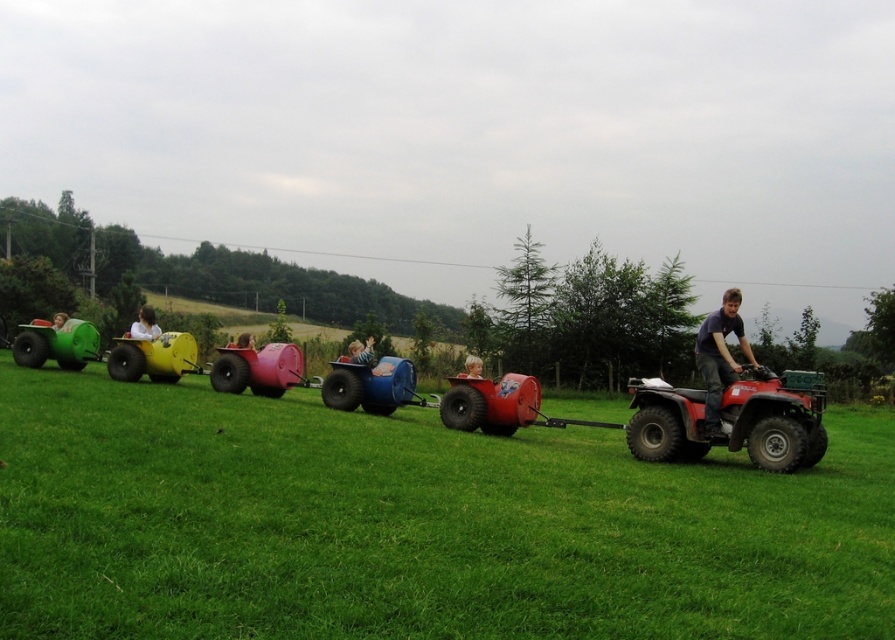
Question: Based on their relative distances, which object is farther from the rubberized plastic cart at center?

Choices:
 (A) blue rubber toy at center
 (B) smooth pink helmet at center
 (C) dark blue shirt at right

Answer: (B)

Question: Can you confirm if smooth pink helmet at center is smaller than matte green cart at left?

Choices:
 (A) no
 (B) yes

Answer: (B)

Question: Which point is closer to the camera?

Choices:
 (A) blue rubber toy at center
 (B) smooth pink helmet at center
 (C) blonde hair at center
 (D) rubberized plastic cart at center

Answer: (D)

Question: In this image, where is rubberized plastic cart at center located relative to matte green cart at left?

Choices:
 (A) above
 (B) below

Answer: (B)

Question: Which point appears farthest from the camera in this image?

Choices:
 (A) (744, 346)
 (B) (158, 332)
 (C) (62, 316)

Answer: (C)

Question: Is white fabric person at center smaller than blue rubber toy at center?

Choices:
 (A) yes
 (B) no

Answer: (B)